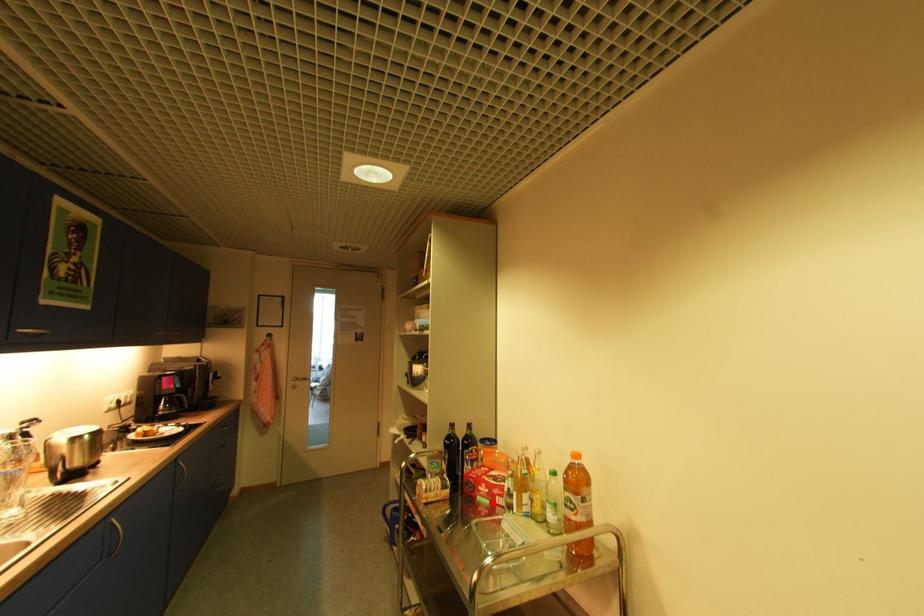
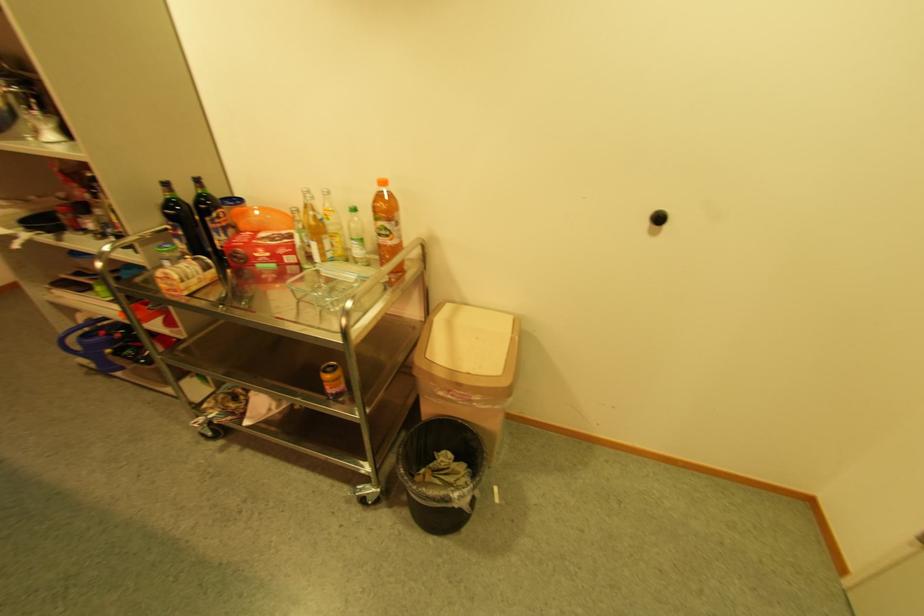
Find the pixel in the second image that matches the highlighted location in the first image.

(278, 267)